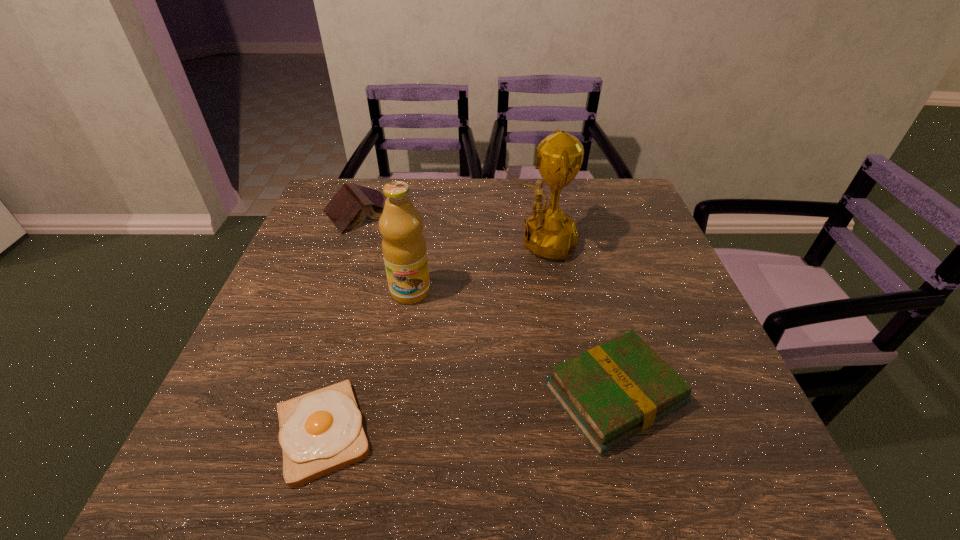
Locate an element on the screen. This screenshot has width=960, height=540. blank space that satisfies the following two spatial constraints: 1. on the front side of the award; 2. on the label of the olive oil is located at coordinates (546, 292).

Locate an element on the screen. The width and height of the screenshot is (960, 540). free space that satisfies the following two spatial constraints: 1. on the back side of the nearer book; 2. on the front side of the award is located at coordinates (575, 242).

The height and width of the screenshot is (540, 960). I want to click on vacant area that satisfies the following two spatial constraints: 1. on the front side of the award; 2. on the right side of the nearer book, so click(x=564, y=395).

The width and height of the screenshot is (960, 540). Find the location of `vacant space that satisfies the following two spatial constraints: 1. on the front side of the left book; 2. on the left side of the right book`. vacant space that satisfies the following two spatial constraints: 1. on the front side of the left book; 2. on the left side of the right book is located at coordinates (297, 395).